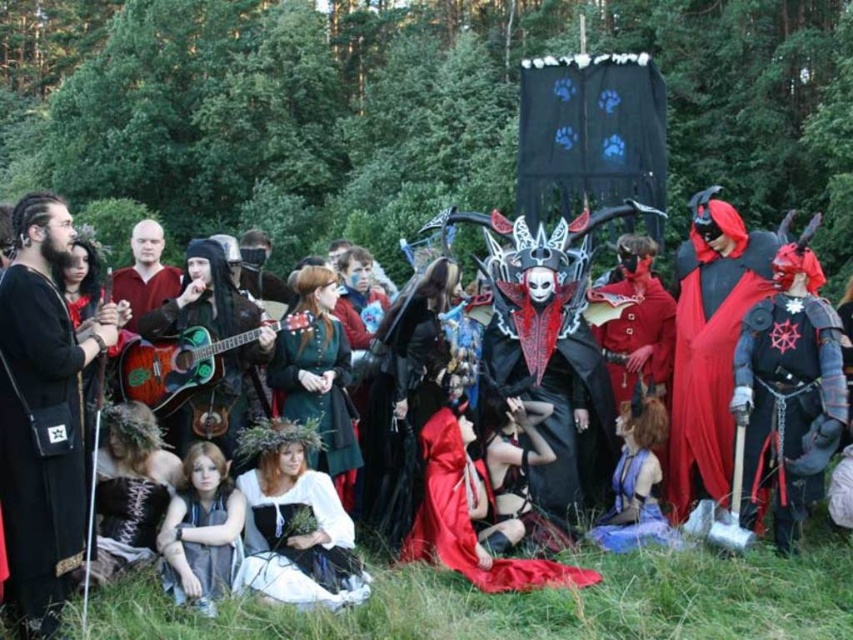
You are a photographer trying to capture a closeup shot of the green matte guitar at center and the smooth red shirt at center. Which object should you zoom in on more to ensure both are in focus?

The green matte guitar at center is thinner than the smooth red shirt at center, so you should zoom in more on the green matte guitar at center to ensure both are in focus.

Based on the photo, you are standing in the forest scene and want to place a small decoration between the two points labeled as point (798,634) and point (775,454). Which point should the decoration be closer to in order to appear closer to the viewer?

The decoration should be placed closer to point (798,634) because it is closer to the viewer than point (775,454) according to the spatial relationship provided.

You are a photographer trying to capture a photo of the black matte robe at left and the smooth red shirt at center. Which one is positioned to the right of the other?

The black matte robe at left is positioned on the right side of smooth red shirt at center.